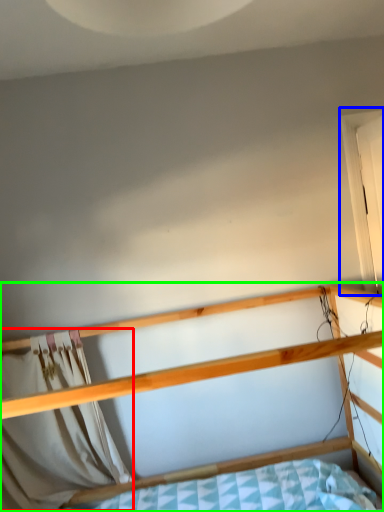
Question: Considering the real-world distances, which object is farthest from curtain (highlighted by a red box)? window (highlighted by a blue box) or bed (highlighted by a green box)?

Choices:
 (A) window
 (B) bed

Answer: (A)